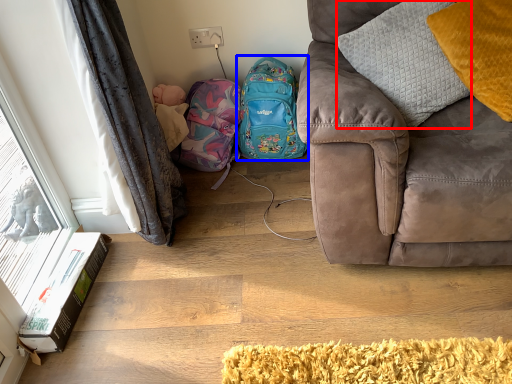
Question: Which object appears closest to the camera in this image, pillow (highlighted by a red box) or backpack (highlighted by a blue box)?

Choices:
 (A) pillow
 (B) backpack

Answer: (A)